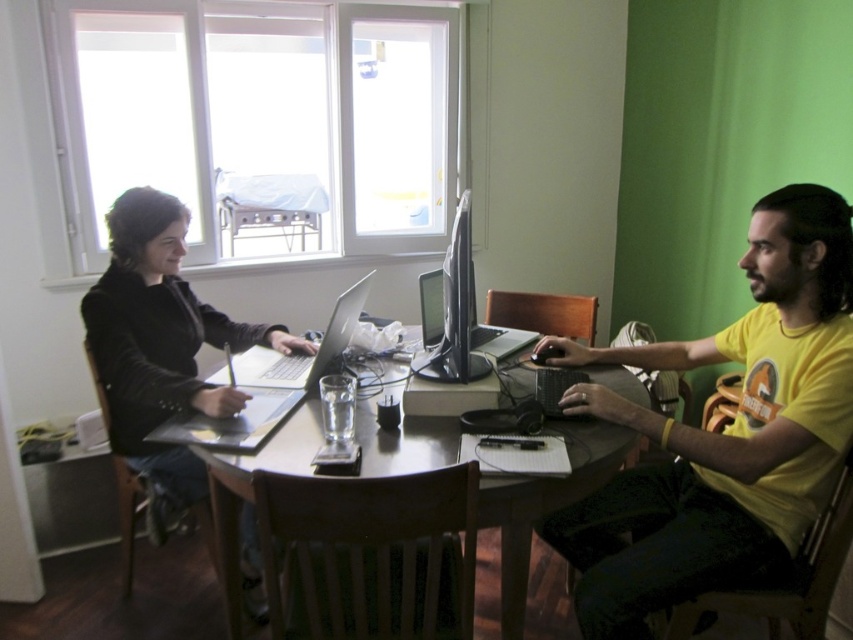
Looking at this image, does wooden table at center appear on the left side of silver metallic laptop at center?

Incorrect, wooden table at center is not on the left side of silver metallic laptop at center.

Does wooden table at center come in front of silver metallic laptop at center?

That is True.

The height and width of the screenshot is (640, 853). Identify the location of wooden table at center. (543, 508).

Who is positioned more to the right, yellow cotton t-shirt at right or silver metallic laptop at center?

Positioned to the right is yellow cotton t-shirt at right.

Can you confirm if yellow cotton t-shirt at right is bigger than silver metallic laptop at center?

Indeed, yellow cotton t-shirt at right has a larger size compared to silver metallic laptop at center.

Where is `yellow cotton t-shirt at right`? Image resolution: width=853 pixels, height=640 pixels. yellow cotton t-shirt at right is located at coordinates (723, 433).

Is point (538, 504) positioned behind point (463, 240)?

No.

The width and height of the screenshot is (853, 640). In order to click on wooden table at center in this screenshot , I will do `click(543, 508)`.